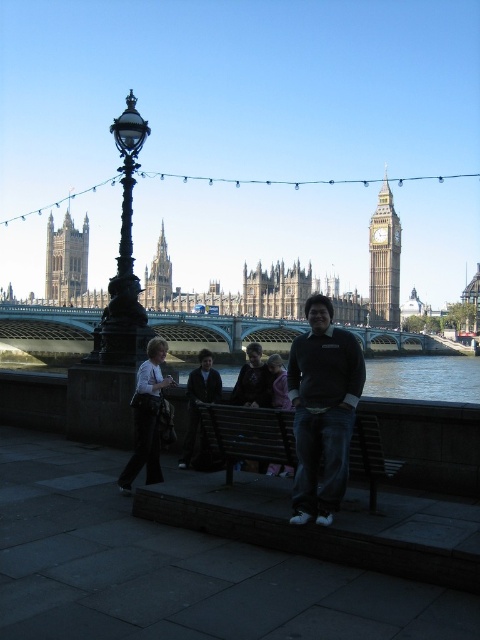
You are standing on the riverside walkway and want to take a photo of the dark blue water at lower center and the dark gray sweater at center. Which object should you focus on first to ensure it appears sharp in the photo?

You should focus on the dark gray sweater at center first because it is closer to you than the dark blue water at lower center, which is further away. This ensures the sweater will be in focus while the water may appear slightly blurred if not focused on first.

You are a photographer trying to capture the entire dark blue water at lower center and dark brown leather jacket at center in a single frame. Given that your camera can only focus on objects that are at least the same size, will you be able to capture both clearly?

The dark blue water at lower center is larger in size than the dark brown leather jacket at center, so the camera can focus on both as the water is sufficiently large to meet the size requirement.

Consider the image. You are a photographer standing on the riverside walkway in London. You notice two people wearing a dark brown leather jacket at center and a dark gray sweater at center. Which clothing item is positioned more to the left side of the scene?

The dark brown leather jacket at center is positioned more to the left side of the scene compared to the dark gray sweater at center.